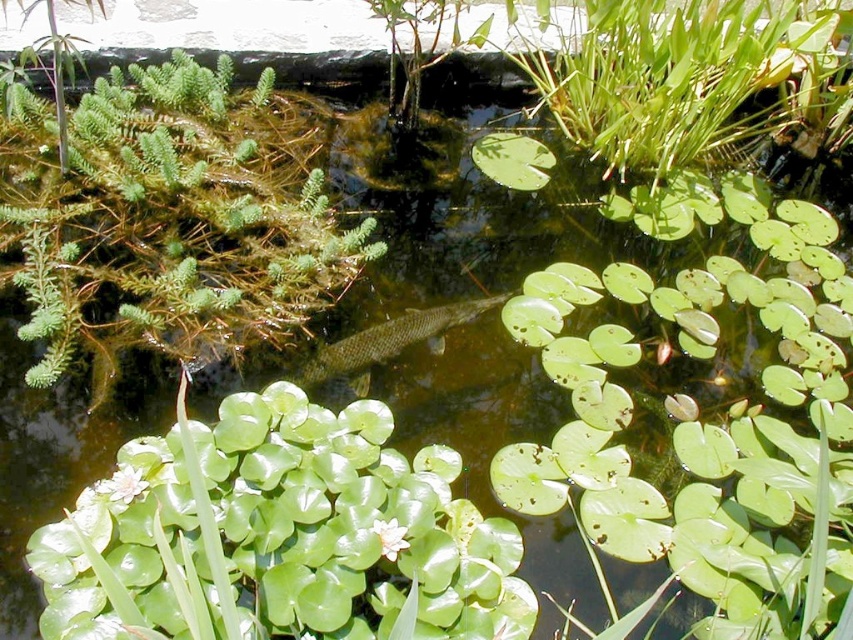
From the picture: Can you confirm if green fuzzy plant at upper left is wider than green scaly fish at center?

Indeed, green fuzzy plant at upper left has a greater width compared to green scaly fish at center.

Is point (112, 150) farther from camera compared to point (334, 358)?

That is True.

Locate an element on the screen. green fuzzy plant at upper left is located at coordinates (172, 218).

Does green glossy lily pads at center appear over green fuzzy plant at upper left?

Actually, green glossy lily pads at center is below green fuzzy plant at upper left.

In the scene shown: Between green glossy lily pads at center and green fuzzy plant at upper left, which one is positioned higher?

green fuzzy plant at upper left is above.

Who is more distant from viewer, (256, 588) or (236, 264)?

The point (236, 264) is behind.

In order to click on green glossy lily pads at center in this screenshot , I will do `click(277, 536)`.

Can you confirm if green glossy lily pads at center is positioned to the right of green scaly fish at center?

Incorrect, green glossy lily pads at center is not on the right side of green scaly fish at center.

Who is higher up, green glossy lily pads at center or green scaly fish at center?

green scaly fish at center is above.

The height and width of the screenshot is (640, 853). In order to click on green glossy lily pads at center in this screenshot , I will do `click(277, 536)`.

Find the location of a particular element. green glossy lily pads at center is located at coordinates (277, 536).